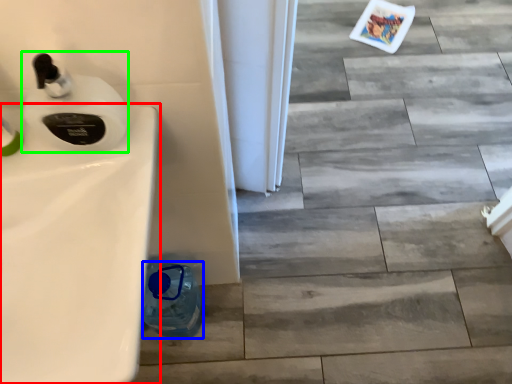
Question: Which is farther away from sink (highlighted by a red box)? bottle (highlighted by a blue box) or soap dispenser (highlighted by a green box)?

Choices:
 (A) bottle
 (B) soap dispenser

Answer: (A)